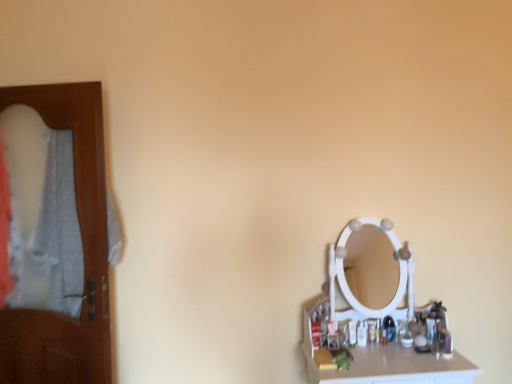
Locate an element on the screen. The width and height of the screenshot is (512, 384). brown wooden door at left is located at coordinates (83, 250).

Where is `white glossy counter top at lower right`? The height and width of the screenshot is (384, 512). white glossy counter top at lower right is located at coordinates (394, 367).

Does white glossy counter top at lower right turn towards brown wooden door at left?

No, white glossy counter top at lower right is not aimed at brown wooden door at left.

Where is `counter top that appears below the brown wooden door at left (from a real-world perspective)`? counter top that appears below the brown wooden door at left (from a real-world perspective) is located at coordinates (394, 367).

Which is further, (x=382, y=362) or (x=78, y=375)?

Positioned behind is point (x=78, y=375).

From the image's perspective, would you say white glossy counter top at lower right is positioned over brown wooden door at left?

No.

The height and width of the screenshot is (384, 512). Find the location of `toiletry positioned vertically above the white glossy counter top at lower right (from a real-world perspective)`. toiletry positioned vertically above the white glossy counter top at lower right (from a real-world perspective) is located at coordinates (352, 333).

Between translucent plastic bottle at right and white glossy counter top at lower right, which one has larger size?

white glossy counter top at lower right is bigger.

From a real-world perspective, is translucent plastic bottle at right below white glossy counter top at lower right?

No, from a real-world perspective, translucent plastic bottle at right is not beneath white glossy counter top at lower right.

From a real-world perspective, who is located lower, translucent plastic bottle at right or brown wooden door at left?

translucent plastic bottle at right.

From the image's perspective, which object appears higher, translucent plastic bottle at right or brown wooden door at left?

brown wooden door at left.

Considering the relative sizes of translucent plastic bottle at right and brown wooden door at left in the image provided, is translucent plastic bottle at right smaller than brown wooden door at left?

Yes.

Find the location of a particular element. The width and height of the screenshot is (512, 384). toiletry that appears behind the brown wooden door at left is located at coordinates (352, 333).

Is translucent plastic bottle at right inside brown wooden door at left?

That's incorrect, translucent plastic bottle at right is not inside brown wooden door at left.

From the image's perspective, is brown wooden door at left under translucent plastic bottle at right?

No, from the image's perspective, brown wooden door at left is not below translucent plastic bottle at right.

Considering their positions, is brown wooden door at left located in front of or behind translucent plastic bottle at right?

brown wooden door at left is in front of translucent plastic bottle at right.

Is white glossy counter top at lower right inside brown wooden door at left?

No, brown wooden door at left does not contain white glossy counter top at lower right.

Is brown wooden door at left turned away from white glossy counter top at lower right?

No, white glossy counter top at lower right is not at the back of brown wooden door at left.

From the picture: Considering the sizes of objects brown wooden door at left and white glossy counter top at lower right in the image provided, who is smaller, brown wooden door at left or white glossy counter top at lower right?

With smaller size is white glossy counter top at lower right.

From a real-world perspective, between brown wooden door at left and white glossy counter top at lower right, who is vertically higher?

From a 3D spatial view, brown wooden door at left is above.

From the image's perspective, relative to translucent plastic bottle at right, is white glossy counter top at lower right above or below?

white glossy counter top at lower right is situated lower than translucent plastic bottle at right in the image.

Does white glossy counter top at lower right have a larger size compared to translucent plastic bottle at right?

Indeed, white glossy counter top at lower right has a larger size compared to translucent plastic bottle at right.

From their relative heights in the image, would you say white glossy counter top at lower right is taller or shorter than translucent plastic bottle at right?

Clearly, white glossy counter top at lower right is taller compared to translucent plastic bottle at right.

Locate an element on the screen. door behind the white glossy counter top at lower right is located at coordinates (83, 250).

Locate an element on the screen. counter top below the translucent plastic bottle at right (from the image's perspective) is located at coordinates (394, 367).

Considering their positions, is white glossy counter top at lower right positioned closer to translucent plastic bottle at right than brown wooden door at left?

white glossy counter top at lower right lies closer to translucent plastic bottle at right than the other object.

Which object lies further to the anchor point white glossy counter top at lower right, brown wooden door at left or translucent plastic bottle at right?

brown wooden door at left lies further to white glossy counter top at lower right than the other object.

Considering their positions, is white glossy counter top at lower right positioned further to brown wooden door at left than translucent plastic bottle at right?

translucent plastic bottle at right.

Looking at the image, which one is located closer to white glossy counter top at lower right, translucent plastic bottle at right or brown wooden door at left?

translucent plastic bottle at right is closer to white glossy counter top at lower right.

Estimate the real-world distances between objects in this image. Which object is further from translucent plastic bottle at right, brown wooden door at left or white glossy counter top at lower right?

Among the two, brown wooden door at left is located further to translucent plastic bottle at right.

Estimate the real-world distances between objects in this image. Which object is closer to brown wooden door at left, translucent plastic bottle at right or white glossy counter top at lower right?

white glossy counter top at lower right is positioned closer to the anchor brown wooden door at left.

I want to click on toiletry situated between brown wooden door at left and white glossy counter top at lower right from left to right, so click(352, 333).